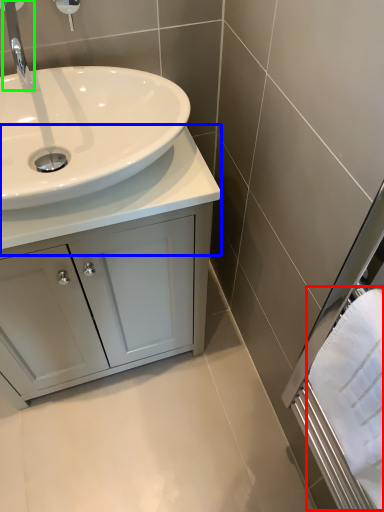
Question: Considering the real-world distances, which object is farthest from bath towel (highlighted by a red box)? counter top (highlighted by a blue box) or tap (highlighted by a green box)?

Choices:
 (A) counter top
 (B) tap

Answer: (B)